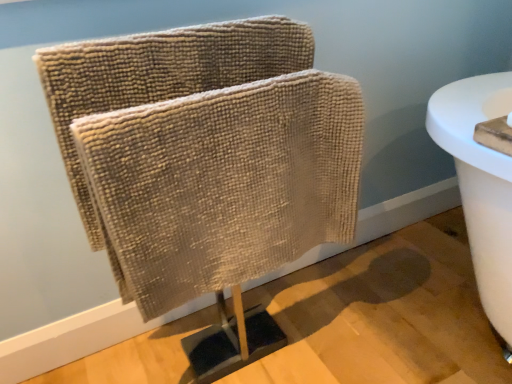
Locate an element on the screen. Image resolution: width=512 pixels, height=384 pixels. vacant space to the right of beige textured towel at center is located at coordinates (388, 323).